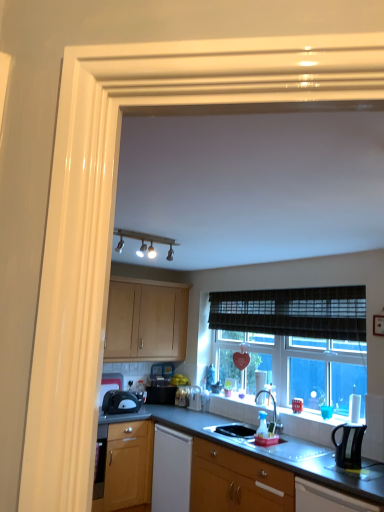
Question: Is white glossy sink at lower center, the 1th sink from the front, turned away from satin nickel faucet at center?

Choices:
 (A) yes
 (B) no

Answer: (B)

Question: Is white glossy sink at lower center, the 1th sink from the front, next to satin nickel faucet at center and touching it?

Choices:
 (A) no
 (B) yes

Answer: (A)

Question: From a real-world perspective, is white glossy sink at lower center, the 2th sink from the back, beneath satin nickel faucet at center?

Choices:
 (A) no
 (B) yes

Answer: (B)

Question: Considering the relative sizes of white glossy sink at lower center, the 1th sink from the front, and satin nickel faucet at center in the image provided, is white glossy sink at lower center, the 1th sink from the front, bigger than satin nickel faucet at center?

Choices:
 (A) yes
 (B) no

Answer: (A)

Question: Is white glossy sink at lower center, the 1th sink from the front, at the right side of satin nickel faucet at center?

Choices:
 (A) no
 (B) yes

Answer: (A)

Question: From the image's perspective, is satin nickel faucet at center positioned above or below black plastic kettle at right, positioned as the 1th kitchen appliance in front-to-back order?

Choices:
 (A) above
 (B) below

Answer: (B)

Question: Choose the correct answer: Is satin nickel faucet at center inside black plastic kettle at right, placed as the second kitchen appliance when sorted from left to right, or outside it?

Choices:
 (A) outside
 (B) inside

Answer: (A)

Question: Relative to black plastic kettle at right, arranged as the 2th kitchen appliance when viewed from the back, is satin nickel faucet at center in front or behind?

Choices:
 (A) front
 (B) behind

Answer: (B)

Question: From a real-world perspective, relative to black plastic kettle at right, marked as the first kitchen appliance in a right-to-left arrangement, is satin nickel faucet at center vertically above or below?

Choices:
 (A) below
 (B) above

Answer: (B)

Question: Visually, is wooden cabinet at lower center, the third cabinetry in the top-to-bottom sequence, positioned to the left or to the right of translucent plastic bottle at sink?

Choices:
 (A) right
 (B) left

Answer: (B)

Question: Is wooden cabinet at lower center, which is the second cabinetry from right to left, wider or thinner than translucent plastic bottle at sink?

Choices:
 (A) thin
 (B) wide

Answer: (B)

Question: Considering their positions, is wooden cabinet at lower center, placed as the 2th cabinetry when sorted from left to right, located in front of or behind translucent plastic bottle at sink?

Choices:
 (A) front
 (B) behind

Answer: (A)

Question: Looking at the image, does wooden cabinet at lower center, the 2th cabinetry positioned from the front, seem bigger or smaller compared to translucent plastic bottle at sink?

Choices:
 (A) big
 (B) small

Answer: (A)

Question: Is light wood cabinet at center, the first cabinetry positioned from the back, to the left or to the right of matte black toaster at lower right, placed as the 3th cabinetry when sorted from back to front, in the image?

Choices:
 (A) right
 (B) left

Answer: (B)

Question: Relative to matte black toaster at lower right, which is the second cabinetry from bottom to top, is light wood cabinet at center, the first cabinetry positioned from the back, in front or behind?

Choices:
 (A) behind
 (B) front

Answer: (A)